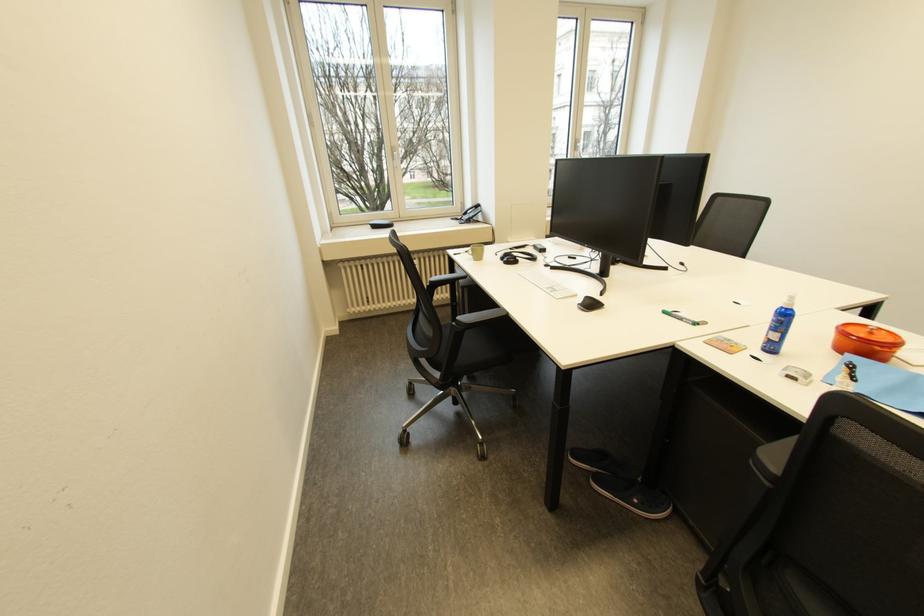
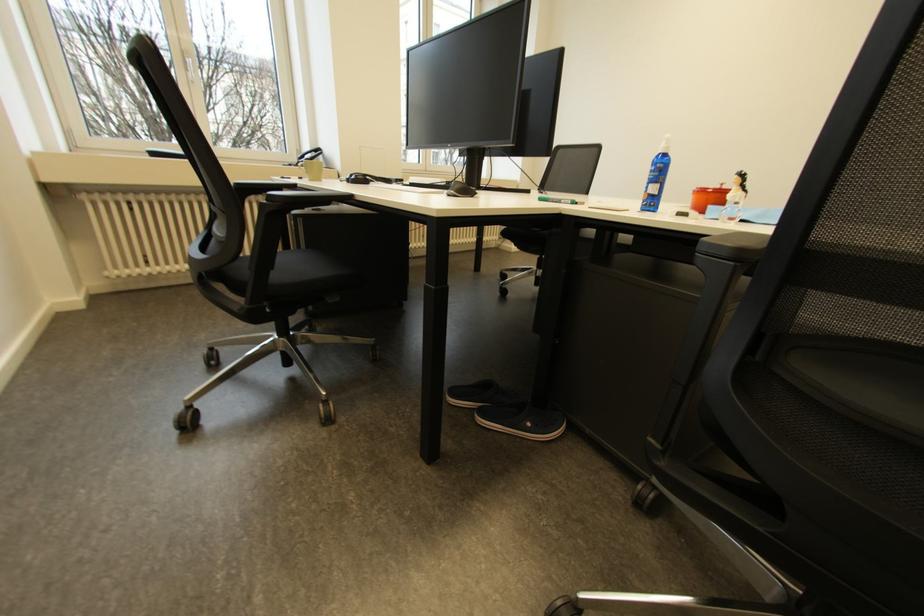
Question: The camera is either moving clockwise (left) or counter-clockwise (right) around the object. The first image is from the beginning of the video and the second image is from the end. Is the camera moving left or right when shooting the video?

Choices:
 (A) Left
 (B) Right

Answer: (A)